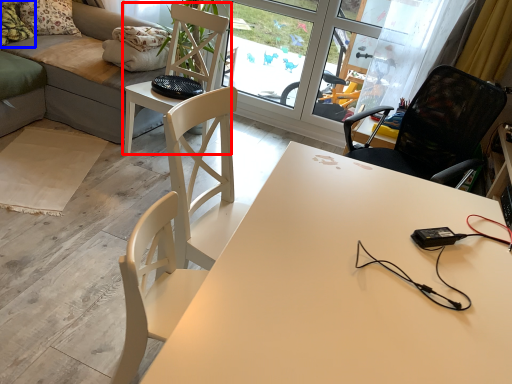
Question: Which object appears farthest to the camera in this image, chair (highlighted by a red box) or pillow (highlighted by a blue box)?

Choices:
 (A) chair
 (B) pillow

Answer: (B)